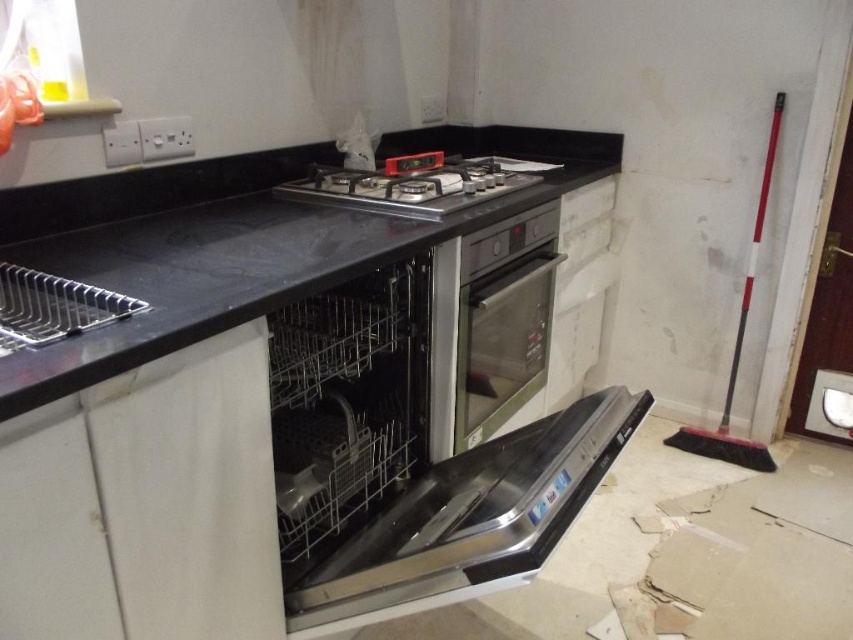
Does satin stainless steel dishwasher at center appear under satin silver oven at center?

Correct, satin stainless steel dishwasher at center is located below satin silver oven at center.

Does satin stainless steel dishwasher at center have a lesser width compared to satin silver oven at center?

Incorrect, satin stainless steel dishwasher at center's width is not less than satin silver oven at center's.

Where is `satin stainless steel dishwasher at center`? Image resolution: width=853 pixels, height=640 pixels. satin stainless steel dishwasher at center is located at coordinates (344, 401).

This screenshot has height=640, width=853. What are the coordinates of `satin stainless steel dishwasher at center` in the screenshot? It's located at (344, 401).

Consider the image. Can you confirm if satin silver oven at center is smaller than black matte gas stove at center?

Yes, satin silver oven at center is smaller than black matte gas stove at center.

Does satin silver oven at center lie behind black matte gas stove at center?

No.

Between point (496, 304) and point (432, 156), which one is positioned in front?

Point (496, 304) is in front.

Locate an element on the screen. satin silver oven at center is located at coordinates (502, 320).

Which of these two, black matte counter top at center or stainless steel dishwasher at center, stands shorter?

stainless steel dishwasher at center is shorter.

Which is below, black matte counter top at center or stainless steel dishwasher at center?

stainless steel dishwasher at center

In order to click on black matte counter top at center in this screenshot , I will do `click(233, 243)`.